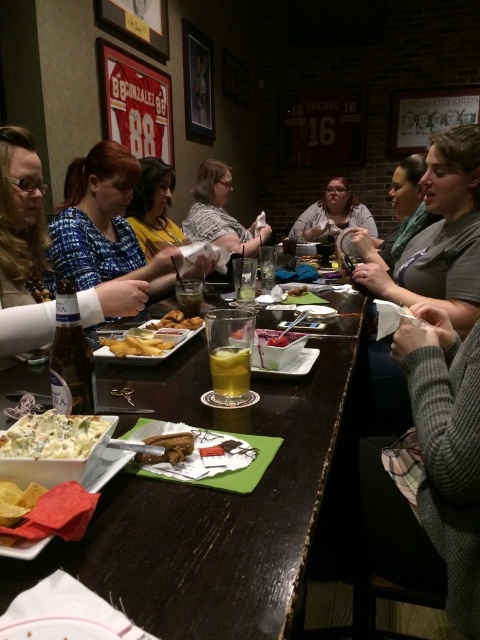
Question: Considering the relative positions of blue printed shirt at center and striped fabric shirt at center in the image provided, where is blue printed shirt at center located with respect to striped fabric shirt at center?

Choices:
 (A) above
 (B) below

Answer: (B)

Question: Which point appears farthest from the camera in this image?

Choices:
 (A) (197, 216)
 (B) (191, 305)
 (C) (36, 499)
 (D) (118, 346)

Answer: (A)

Question: Which object is closer to the camera taking this photo?

Choices:
 (A) white creamy pasta at center
 (B) golden fried chicken at center

Answer: (A)

Question: Does matte gray sweater at center appear on the right side of translucent glass at table center?

Choices:
 (A) no
 (B) yes

Answer: (B)

Question: Which object appears closest to the camera in this image?

Choices:
 (A) yellow tortilla chips at lower left
 (B) striped fabric shirt at center
 (C) golden fried chicken at center
 (D) white creamy pasta at center

Answer: (A)

Question: Observing the image, what is the correct spatial positioning of blue printed shirt at center in reference to translucent glass bowl at center?

Choices:
 (A) left
 (B) right

Answer: (A)